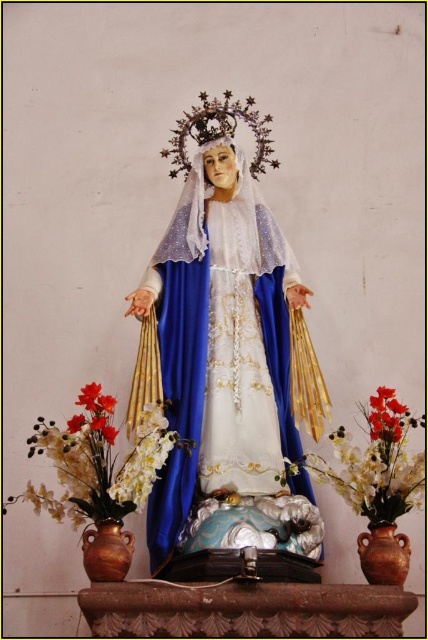
Can you confirm if white artificial flowers at lower left is positioned to the right of silky white petals at lower center?

No, white artificial flowers at lower left is not to the right of silky white petals at lower center.

This screenshot has height=640, width=428. What do you see at coordinates (98, 461) in the screenshot? I see `white artificial flowers at lower left` at bounding box center [98, 461].

I want to click on white artificial flowers at lower left, so click(x=98, y=461).

Does white artificial flowers at lower left have a smaller size compared to brown earthenware vase at lower right?

Incorrect, white artificial flowers at lower left is not smaller in size than brown earthenware vase at lower right.

Looking at this image, can you confirm if white artificial flowers at lower left is bigger than brown earthenware vase at lower right?

Yes, white artificial flowers at lower left is bigger than brown earthenware vase at lower right.

What do you see at coordinates (98, 461) in the screenshot?
I see `white artificial flowers at lower left` at bounding box center [98, 461].

At what (x,y) coordinates should I click in order to perform the action: click on white artificial flowers at lower left. Please return your answer as a coordinate pair (x, y). The image size is (428, 640). Looking at the image, I should click on (98, 461).

Who is positioned more to the right, matte white statue at center or white artificial flowers at lower left?

matte white statue at center is more to the right.

Describe the element at coordinates (228, 346) in the screenshot. I see `matte white statue at center` at that location.

The height and width of the screenshot is (640, 428). In order to click on matte white statue at center in this screenshot , I will do click(x=228, y=346).